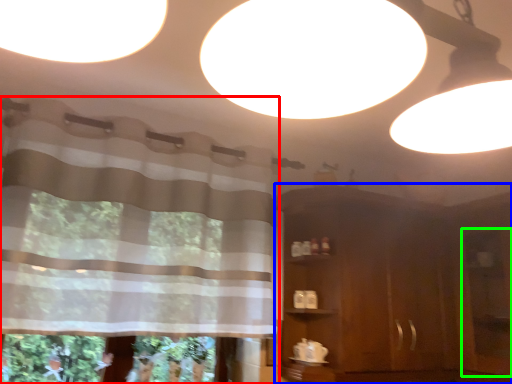
Question: Which object is the farthest from curtain (highlighted by a red box)? Choose among these: dresser (highlighted by a blue box) or screen door (highlighted by a green box).

Choices:
 (A) dresser
 (B) screen door

Answer: (B)